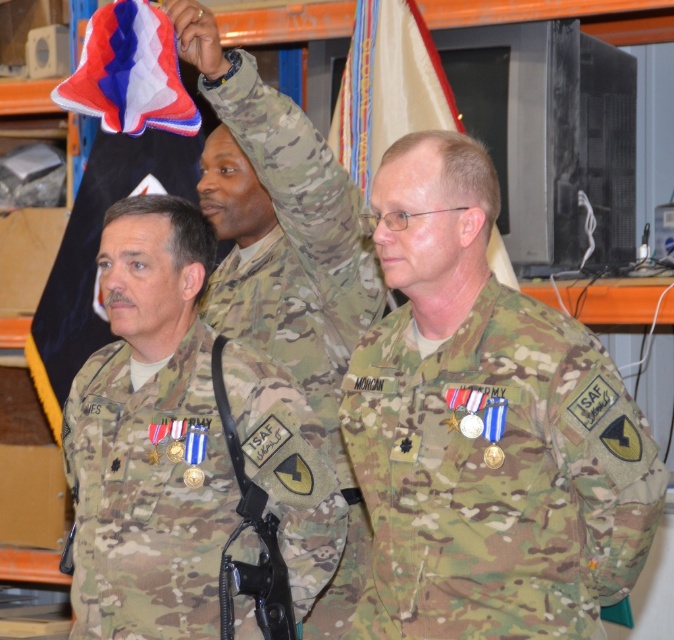
Which is more to the right, camouflage uniform at center or camo fabric uniform at center?

From the viewer's perspective, camouflage uniform at center appears more on the right side.

Is point (516, 554) more distant than point (315, 144)?

No.

Is point (491, 333) less distant than point (282, 362)?

Yes, it is.

This screenshot has height=640, width=674. What are the coordinates of `camouflage uniform at center` in the screenshot? It's located at (485, 429).

Can you confirm if camouflage uniform at center is positioned to the left of yellow fabric flag at upper center?

In fact, camouflage uniform at center is to the right of yellow fabric flag at upper center.

Can you confirm if camouflage uniform at center is taller than yellow fabric flag at upper center?

Indeed, camouflage uniform at center has a greater height compared to yellow fabric flag at upper center.

Who is more forward, (379, 369) or (367, 1)?

Point (379, 369) is more forward.

The height and width of the screenshot is (640, 674). Identify the location of camouflage uniform at center. (485, 429).

Is multicam uniform at center taller than yellow fabric flag at upper center?

Yes.

Does multicam uniform at center appear over yellow fabric flag at upper center?

No.

Which is in front, point (127, 353) or point (342, 150)?

Point (127, 353) is in front.

You are a GUI agent. You are given a task and a screenshot of the screen. Output one action in this format:
    pyautogui.click(x=<x>, y=<y>)
    Task: Click on the multicam uniform at center
    
    Given the screenshot: What is the action you would take?
    (x=148, y=493)